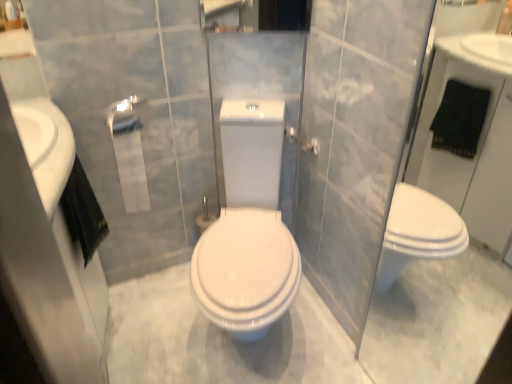
Question: Does point (142, 206) appear closer or farther from the camera than point (310, 139)?

Choices:
 (A) closer
 (B) farther

Answer: (B)

Question: Is white matte toilet paper at center wider or thinner than silver metallic towel bar at upper center?

Choices:
 (A) wide
 (B) thin

Answer: (A)

Question: Based on their relative distances, which object is nearer to the white matte toilet paper at center?

Choices:
 (A) silver metallic towel bar at upper center
 (B) transparent glass door at right
 (C) white glossy sink at left

Answer: (C)

Question: Which object is the closest to the transparent glass door at right?

Choices:
 (A) silver metallic towel bar at upper center
 (B) white glossy sink at left
 (C) white matte toilet paper at center

Answer: (A)